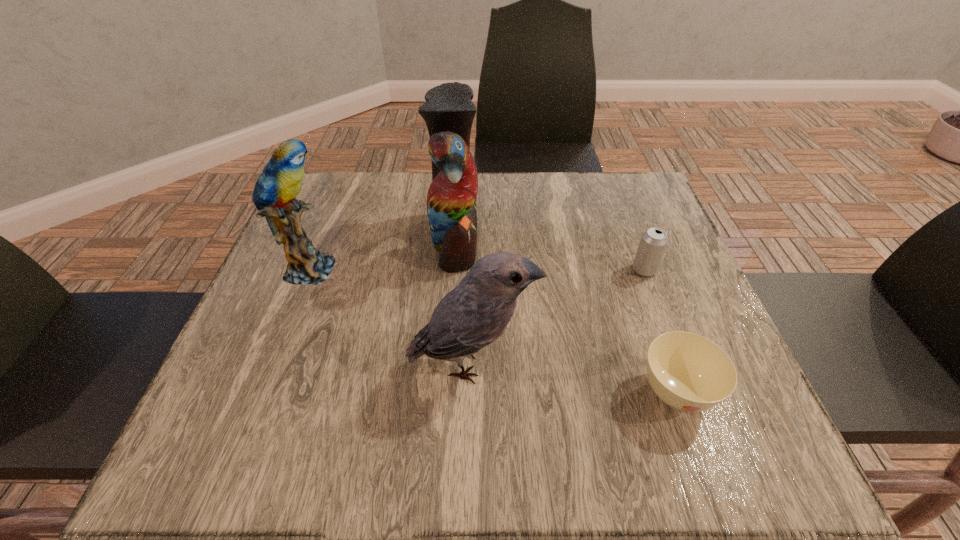
Locate an element on the screen. blank area in the image that satisfies the following two spatial constraints: 1. on the front side of the beer can; 2. on the front-facing side of the shortest parrot is located at coordinates (680, 363).

Locate an element on the screen. The image size is (960, 540). vacant region that satisfies the following two spatial constraints: 1. on the back side of the sugar bowl; 2. on the front-facing side of the shortest parrot is located at coordinates (665, 363).

Locate an element on the screen. This screenshot has height=540, width=960. vacant area in the image that satisfies the following two spatial constraints: 1. on the back side of the shortest object; 2. on the front-facing side of the third shortest object is located at coordinates (665, 363).